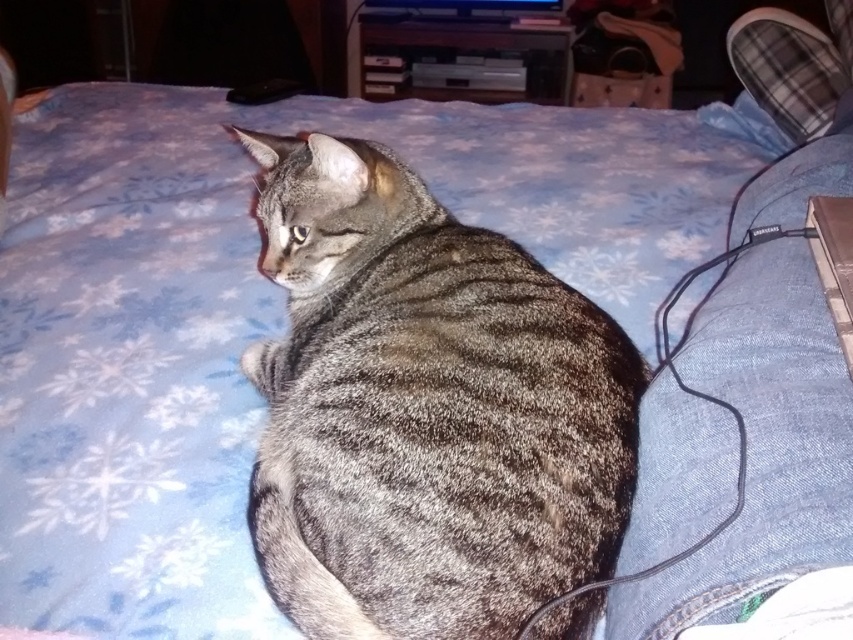
Question: Is gray striped fur cat at center behind black matte laptop at upper right?

Choices:
 (A) yes
 (B) no

Answer: (B)

Question: Which of the following is the farthest from the observer?

Choices:
 (A) click(x=834, y=305)
 (B) click(x=695, y=406)

Answer: (A)

Question: Does denim at lower right appear on the left side of black matte laptop at upper right?

Choices:
 (A) no
 (B) yes

Answer: (A)

Question: Which object appears farthest from the camera in this image?

Choices:
 (A) denim at lower right
 (B) gray striped fur cat at center
 (C) black matte laptop at upper right

Answer: (C)

Question: Among these points, which one is farthest from the camera?

Choices:
 (A) tap(432, 385)
 (B) tap(773, 580)

Answer: (A)

Question: Does gray striped fur cat at center have a smaller size compared to black matte laptop at upper right?

Choices:
 (A) no
 (B) yes

Answer: (A)